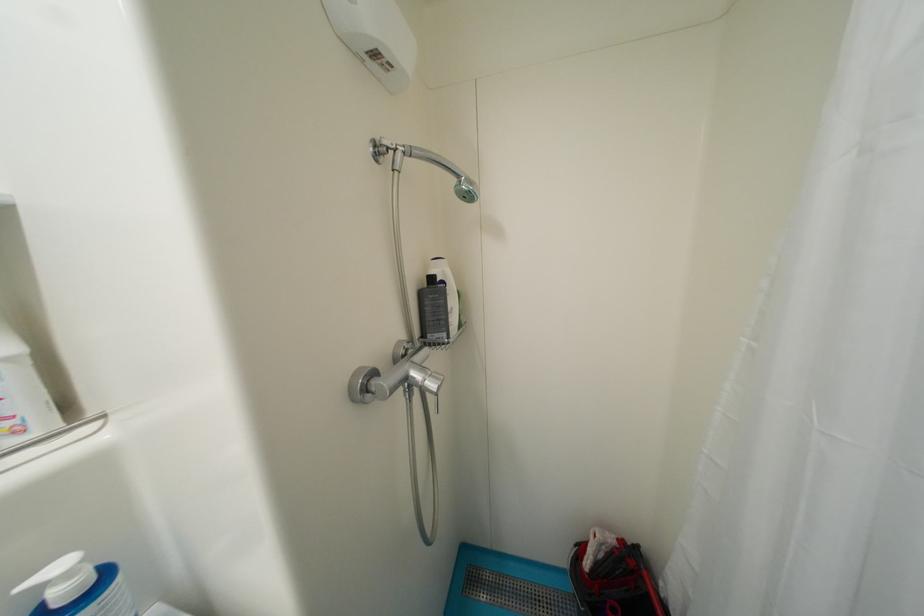
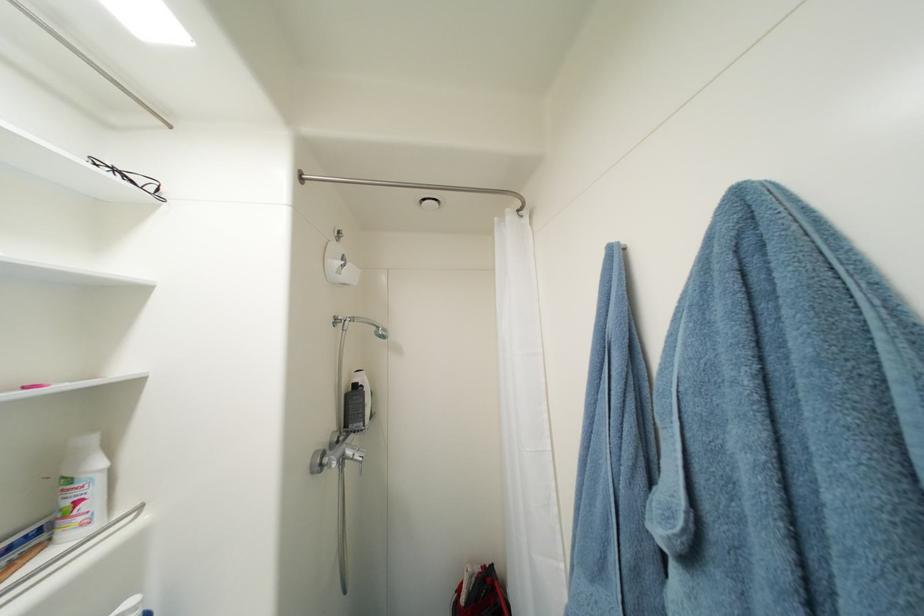
In the second image, find the point that corresponds to pixel 593 565 in the first image.

(469, 602)